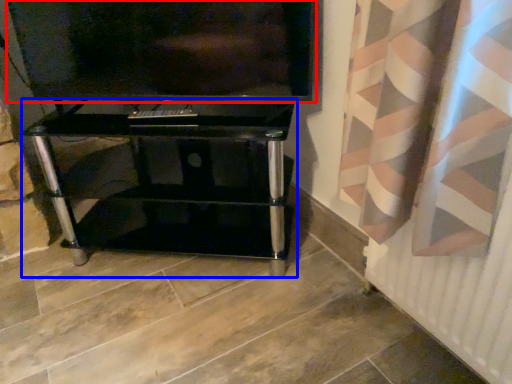
Question: Among these objects, which one is nearest to the camera, television (highlighted by a red box) or furniture (highlighted by a blue box)?

Choices:
 (A) television
 (B) furniture

Answer: (A)